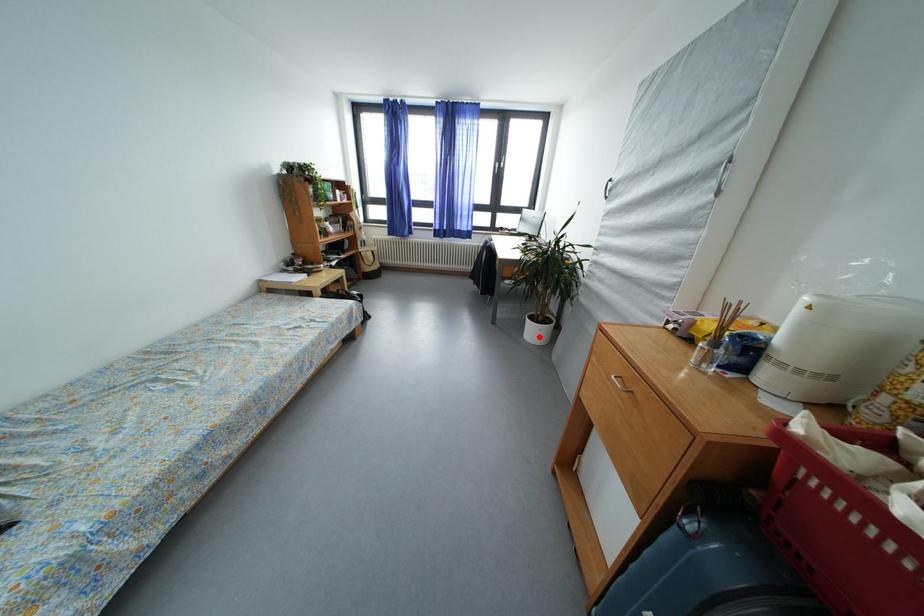
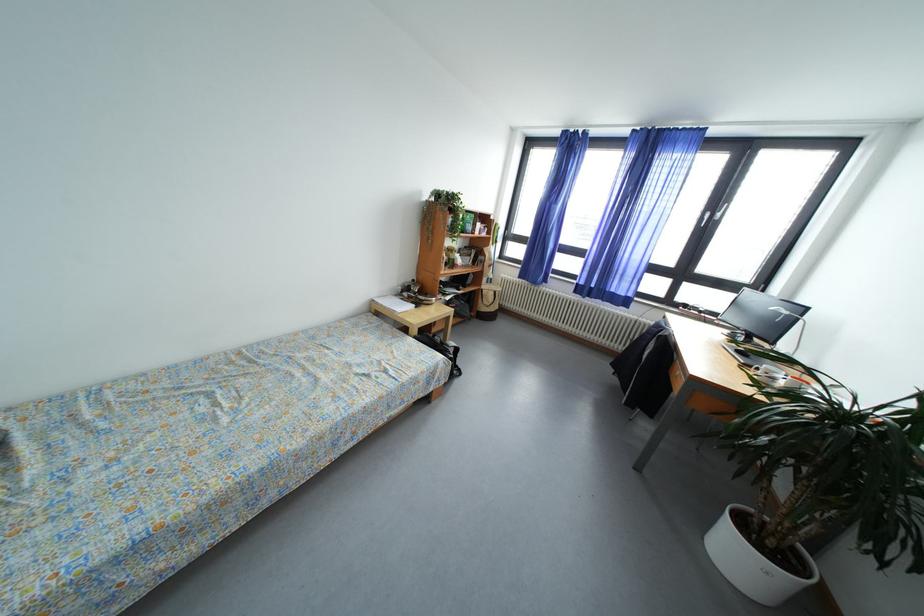
Question: I am providing you with two images of the same scene from different viewpoints. Given a red point in image1, look at the same physical point in image2. Is it:

Choices:
 (A) Closer to the viewpoint
 (B) Farther from the viewpoint

Answer: (B)